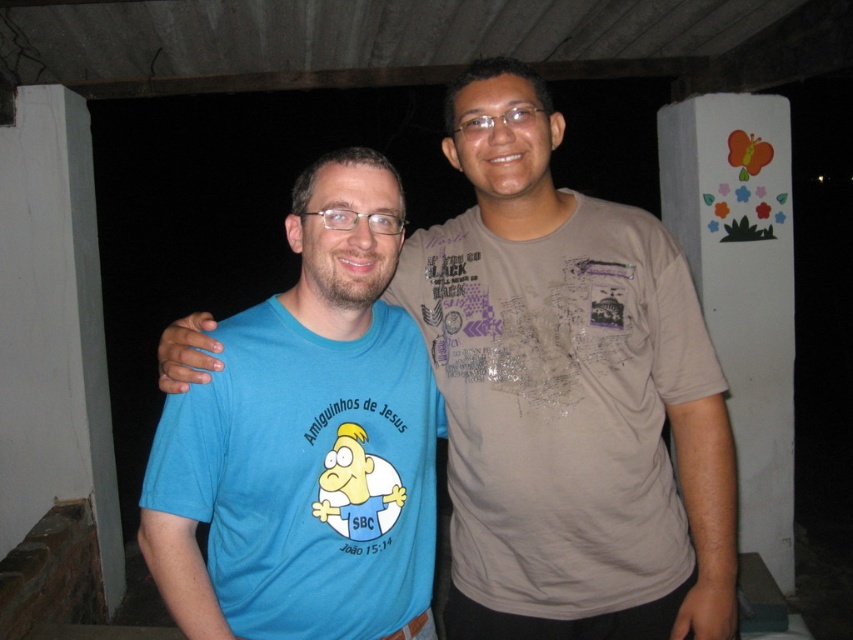
You are a photographer trying to capture the blue cotton shirt at center in your shot. Based on its 2D coordinates, where should you position your camera to ensure it is centered in the frame?

The blue cotton shirt at center is located at coordinates point [567,394], so positioning the camera to aim directly at those coordinates will center it in the frame.

You are standing at the blue cotton shirt at center and want to reach the white painted pillar at right without moving your feet. Can you touch the pillar with your outstretched hand? Assume your arm can reach 6 feet.

The blue cotton shirt at center is 7.45 feet away from the white painted pillar at right. Since your arm can only reach 6 feet, you cannot touch the pillar without moving your feet.

Looking at this image, you are a photographer trying to capture the matte brown tshirt at center in the image. The camera you are using has a focus point set at coordinate point (561, 404). Will the focus point successfully capture the matte brown tshirt at center?

The point (561, 404) indicates the location of the matte brown tshirt at center, so yes, the focus point at (561, 404) will successfully capture the matte brown tshirt at center.